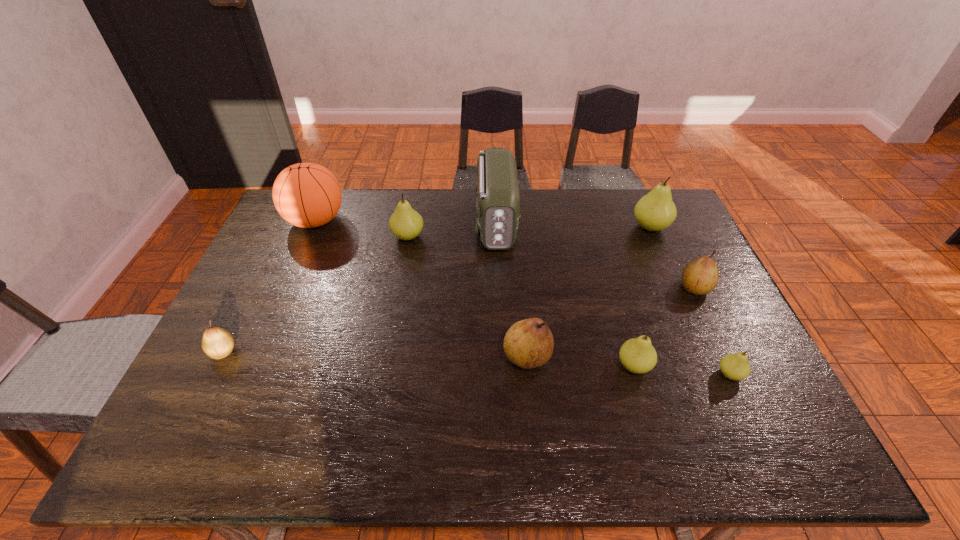
Identify the location of the third green pear from right to left. This screenshot has height=540, width=960. (637, 355).

The height and width of the screenshot is (540, 960). I want to click on the leftmost pear, so click(217, 343).

At what (x,y) coordinates should I click in order to perform the action: click on the leftmost brown pear. Please return your answer as a coordinate pair (x, y). The width and height of the screenshot is (960, 540). Looking at the image, I should click on tap(217, 343).

Find the location of a particular element. the smallest green pear is located at coordinates pos(735,366).

Where is `free space located on the front-facing side of the radio_receiver`? Image resolution: width=960 pixels, height=540 pixels. free space located on the front-facing side of the radio_receiver is located at coordinates (500, 339).

Where is `free space located on the right of the basketball`? free space located on the right of the basketball is located at coordinates (424, 220).

Identify the location of free space located on the left of the tallest pear. This screenshot has height=540, width=960. (566, 227).

Where is `free space located 0.120m on the left of the leftmost green pear`? The width and height of the screenshot is (960, 540). free space located 0.120m on the left of the leftmost green pear is located at coordinates (355, 237).

You are a GUI agent. You are given a task and a screenshot of the screen. Output one action in this format:
    pyautogui.click(x=<x>, y=<y>)
    Task: Click on the vacant space located 0.370m on the left of the second brown pear from left to right
    Image resolution: width=960 pixels, height=540 pixels.
    Given the screenshot: What is the action you would take?
    [358, 357]

Find the location of a particular element. blank area located on the back of the fifth nearest pear is located at coordinates (653, 199).